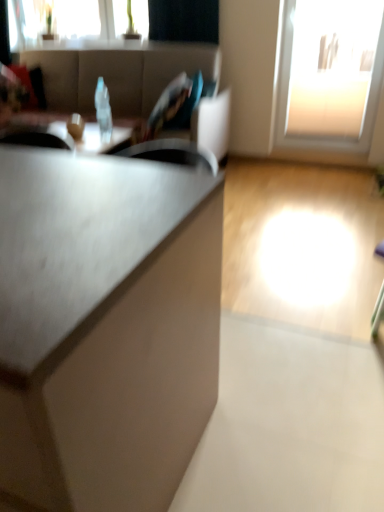
Measure the distance between point (55, 360) and camera.

They are 23.70 inches apart.

What do you see at coordinates (75, 126) in the screenshot? Image resolution: width=384 pixels, height=512 pixels. I see `matte white bowl at center` at bounding box center [75, 126].

You are a GUI agent. You are given a task and a screenshot of the screen. Output one action in this format:
    pyautogui.click(x=<x>, y=<y>)
    Task: Click on the transparent glass window at upper left, the 2th window from the right
    This screenshot has height=512, width=384.
    Given the screenshot: What is the action you would take?
    pyautogui.click(x=88, y=18)

How much space does transparent glass door at upper right, which is the second window in top-to-bottom order, occupy vertically?

transparent glass door at upper right, which is the second window in top-to-bottom order, is 4.03 feet tall.

You are a GUI agent. You are given a task and a screenshot of the screen. Output one action in this format:
    pyautogui.click(x=<x>, y=<y>)
    Task: Click on the transparent glass door at upper right, acting as the 1th window starting from the right
    
    Given the screenshot: What is the action you would take?
    pyautogui.click(x=329, y=74)

Locate an element on the screen. transparent plastic bottle at center is located at coordinates (103, 111).

From the image's perspective, which is above, matte gray cabinet at center or matte gray couch at upper left?

matte gray couch at upper left is shown above in the image.

Is matte gray cabinet at center at the left side of matte gray couch at upper left?

No, matte gray cabinet at center is not to the left of matte gray couch at upper left.

Considering the sizes of objects matte gray cabinet at center and matte gray couch at upper left in the image provided, who is shorter, matte gray cabinet at center or matte gray couch at upper left?

Standing shorter between the two is matte gray cabinet at center.

Are transparent glass door at upper right, which is the 2th window from left to right, and transparent plastic bottle at center far apart?

Yes, transparent glass door at upper right, which is the 2th window from left to right, is far from transparent plastic bottle at center.

In terms of height, does transparent glass door at upper right, which is the second window in top-to-bottom order, look taller or shorter compared to transparent plastic bottle at center?

Considering their sizes, transparent glass door at upper right, which is the second window in top-to-bottom order, has more height than transparent plastic bottle at center.

Is point (318, 104) in front of point (96, 106)?

No.

How distant is transparent glass door at upper right, which is the 2th window from left to right, from transparent plastic bottle at center?

They are 1.92 meters apart.

From the image's perspective, which one is positioned higher, matte black table at center or matte white bowl at center?

matte black table at center appears higher in the image.

Can you tell me how much matte black table at center and matte white bowl at center differ in facing direction?

They differ by 0.000579 degrees in their facing directions.

In the scene shown: Are matte black table at center and matte white bowl at center far apart?

No, matte black table at center is not far from matte white bowl at center.

Is matte black table at center wider than matte gray couch at upper left?

Incorrect, the width of matte black table at center does not surpass that of matte gray couch at upper left.

From their relative heights in the image, would you say matte black table at center is taller or shorter than matte gray couch at upper left?

In the image, matte black table at center appears to be shorter than matte gray couch at upper left.

In the image, is matte black table at center positioned in front of or behind matte gray couch at upper left?

matte black table at center is behind matte gray couch at upper left.

Do you think matte black table at center is within matte gray couch at upper left, or outside of it?

matte black table at center is enclosed within matte gray couch at upper left.

Is transparent plastic bottle at center wider than transparent glass door at upper right, the 1th window positioned from the bottom?

Incorrect, the width of transparent plastic bottle at center does not surpass that of transparent glass door at upper right, the 1th window positioned from the bottom.

From the picture: From a real-world perspective, is transparent plastic bottle at center positioned above or below transparent glass door at upper right, which is the 2th window from left to right?

transparent plastic bottle at center is situated lower than transparent glass door at upper right, which is the 2th window from left to right, in the real world.

From the image's perspective, which object appears higher, transparent plastic bottle at center or transparent glass door at upper right, which is the 2th window from left to right?

transparent glass door at upper right, which is the 2th window from left to right.

Based on the photo, is transparent plastic bottle at center facing towards transparent glass door at upper right, acting as the 1th window starting from the right?

No, transparent plastic bottle at center is not facing towards transparent glass door at upper right, acting as the 1th window starting from the right.

Between point (340, 117) and point (135, 91), which one is positioned behind?

Positioned behind is point (340, 117).

Between transparent glass door at upper right, which is the second window in top-to-bottom order, and matte gray couch at upper left, which one is positioned behind?

transparent glass door at upper right, which is the second window in top-to-bottom order, is behind.

Is matte gray couch at upper left surrounded by transparent glass door at upper right, which is the 2th window from left to right?

That's incorrect, matte gray couch at upper left is not inside transparent glass door at upper right, which is the 2th window from left to right.

From the image's perspective, is transparent glass door at upper right, acting as the 1th window starting from the right, positioned above or below matte gray couch at upper left?

From the image's perspective, transparent glass door at upper right, acting as the 1th window starting from the right, appears above matte gray couch at upper left.

Visually, is matte black table at center positioned to the left or to the right of transparent glass door at upper right, the 1th window positioned from the bottom?

matte black table at center is to the left of transparent glass door at upper right, the 1th window positioned from the bottom.

How many degrees apart are the facing directions of matte black table at center and transparent glass door at upper right, which is the second window in top-to-bottom order?

The facing directions of matte black table at center and transparent glass door at upper right, which is the second window in top-to-bottom order, are 0.636 degrees apart.

From the image's perspective, which one is positioned lower, matte black table at center or transparent glass door at upper right, which is the 2th window from left to right?

matte black table at center.

From a real-world perspective, is matte black table at center under transparent glass door at upper right, acting as the 1th window starting from the right?

Yes.

Identify the location of cabinetry located underneath the matte gray couch at upper left (from a real-world perspective). This screenshot has width=384, height=512. (110, 319).

In order to click on the 1st window behind when counting from the transparent plastic bottle at center in this screenshot , I will do click(x=329, y=74).

Based on their spatial positions, is matte black table at center or transparent glass door at upper right, which is the 2th window from left to right, closer to matte white bowl at center?

The object closer to matte white bowl at center is matte black table at center.

Considering their positions, is matte black table at center positioned further to matte gray cabinet at center than transparent glass window at upper left, acting as the 1th window starting from the top?

transparent glass window at upper left, acting as the 1th window starting from the top, is further to matte gray cabinet at center.

Based on their spatial positions, is matte gray cabinet at center or matte gray couch at upper left further from transparent glass door at upper right, which is the 2th window from left to right?

matte gray cabinet at center lies further to transparent glass door at upper right, which is the 2th window from left to right, than the other object.

From the image, which object appears to be farther from transparent plastic bottle at center, matte white bowl at center or transparent glass door at upper right, acting as the 1th window starting from the right?

transparent glass door at upper right, acting as the 1th window starting from the right, is further to transparent plastic bottle at center.

Based on their spatial positions, is matte gray cabinet at center or matte gray couch at upper left further from transparent plastic bottle at center?

The object further to transparent plastic bottle at center is matte gray cabinet at center.

Considering their positions, is transparent plastic bottle at center positioned further to matte white bowl at center than transparent glass door at upper right, the 1th window positioned from the bottom?

transparent glass door at upper right, the 1th window positioned from the bottom, is further to matte white bowl at center.

From the image, which object appears to be nearer to transparent plastic bottle at center, transparent glass door at upper right, which is the 2th window from left to right, or matte gray couch at upper left?

matte gray couch at upper left is closer to transparent plastic bottle at center.

Looking at the image, which one is located closer to transparent plastic bottle at center, matte gray cabinet at center or transparent glass door at upper right, which is the second window in top-to-bottom order?

The object closer to transparent plastic bottle at center is transparent glass door at upper right, which is the second window in top-to-bottom order.

Where is `studio couch between matte white bowl at center and transparent glass door at upper right, acting as the 1th window starting from the right, in the horizontal direction`? This screenshot has width=384, height=512. studio couch between matte white bowl at center and transparent glass door at upper right, acting as the 1th window starting from the right, in the horizontal direction is located at coordinates (134, 80).

Where is `table between matte gray cabinet at center and transparent glass door at upper right, which is the second window in top-to-bottom order, in the front-back direction`? table between matte gray cabinet at center and transparent glass door at upper right, which is the second window in top-to-bottom order, in the front-back direction is located at coordinates (62, 135).

Find the location of a particular element. bottle between matte gray couch at upper left and matte white bowl at center in the up-down direction is located at coordinates (103, 111).

The width and height of the screenshot is (384, 512). In order to click on bowl positioned between matte gray cabinet at center and transparent glass window at upper left, acting as the 1th window starting from the top, from near to far in this screenshot , I will do `click(75, 126)`.